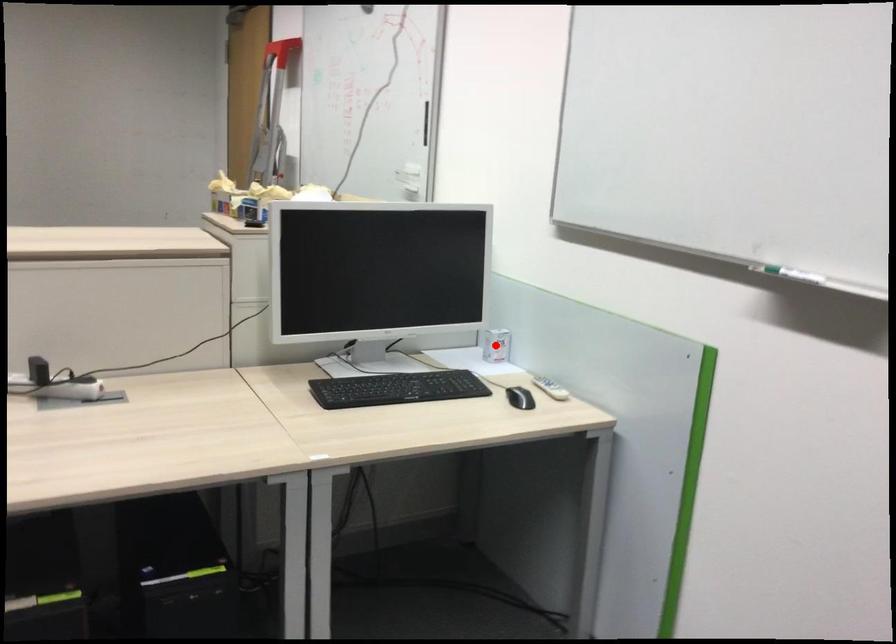
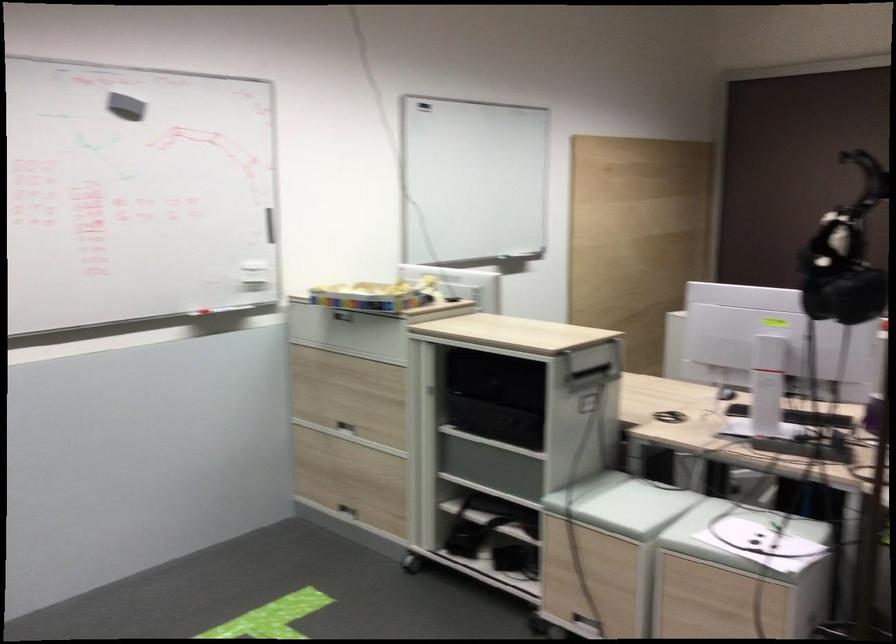
Question: I am providing you with two images of the same scene from different viewpoints. A red point is marked on the first image. Can you still see the location of the red point in image 2?

Choices:
 (A) Yes
 (B) No

Answer: (B)